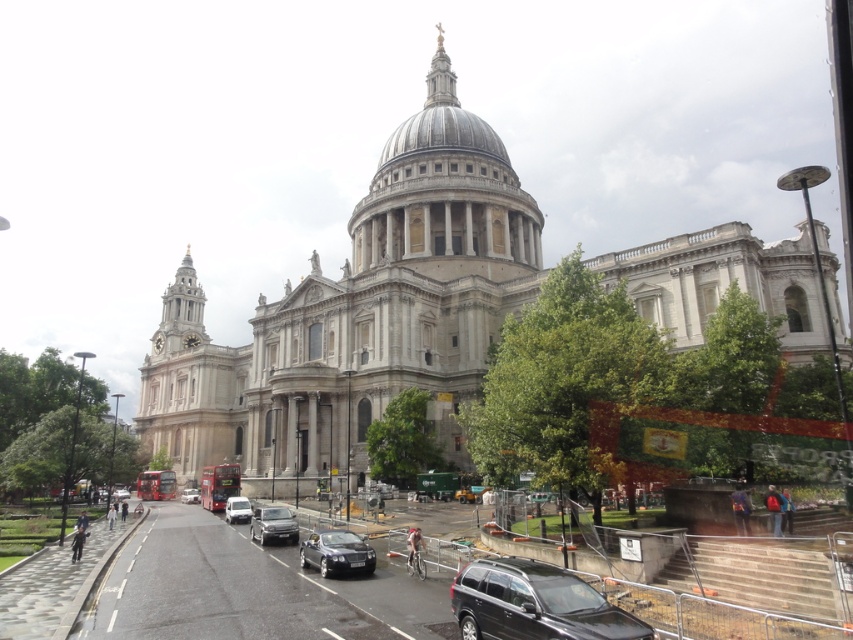
Who is lower down, black matte suv at lower center or shiny silver car at center?

shiny silver car at center is lower down.

Which is more to the left, black matte suv at lower center or shiny silver car at center?

shiny silver car at center is more to the left.

Find the location of `black matte suv at lower center`. black matte suv at lower center is located at coordinates (535, 604).

Does point (329, 573) lie in front of point (115, 499)?

Yes.

Between point (372, 560) and point (120, 492), which one is positioned in front?

Positioned in front is point (372, 560).

This screenshot has height=640, width=853. Identify the location of shiny black car at center. (335, 552).

From the picture: Which is more to the right, shiny black car at center or silver metallic van at center?

From the viewer's perspective, shiny black car at center appears more on the right side.

Measure the distance between shiny black car at center and camera.

shiny black car at center and camera are 46.45 meters apart.

The width and height of the screenshot is (853, 640). I want to click on shiny black car at center, so click(x=335, y=552).